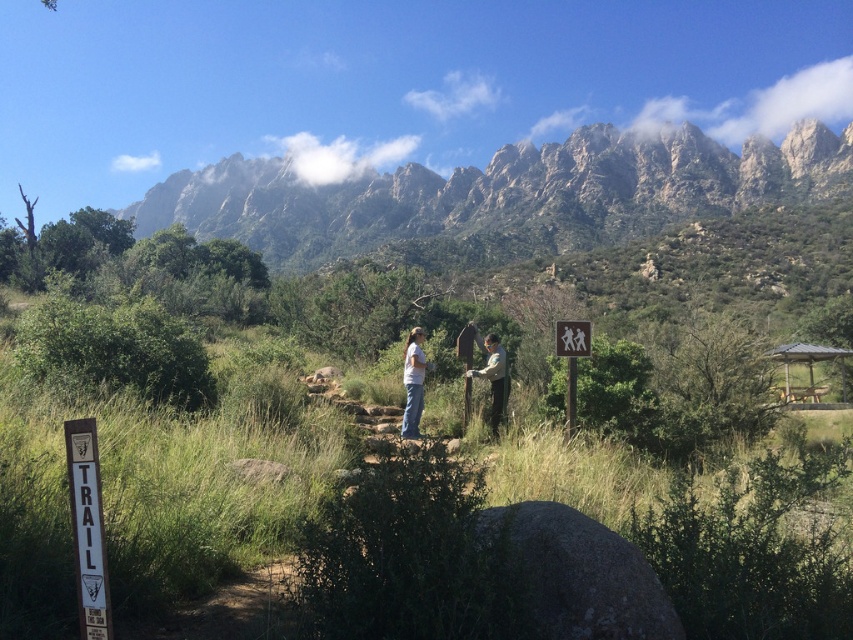
You are a hiker planning to follow the TRAIL sign. You see the white wooden sign at lower left and the wooden signpost at center. Which one is closer to you?

The white wooden sign at lower left is closer because it is in front of the wooden signpost at center.

You are a hiker planning to walk from the white wooden sign at lower left to the wooden signpost at center. How far apart are these two signs?

The white wooden sign at lower left and wooden signpost at center are 10.08 meters apart from each other.

You are a hiker trying to follow the trail. There are two points marked on your map at coordinates point (488, 257) and point (506, 397). Based on the scene, which point should you reach first while moving along the trail?

You should reach point (506, 397) first because point (488, 257) is behind it along the trail.